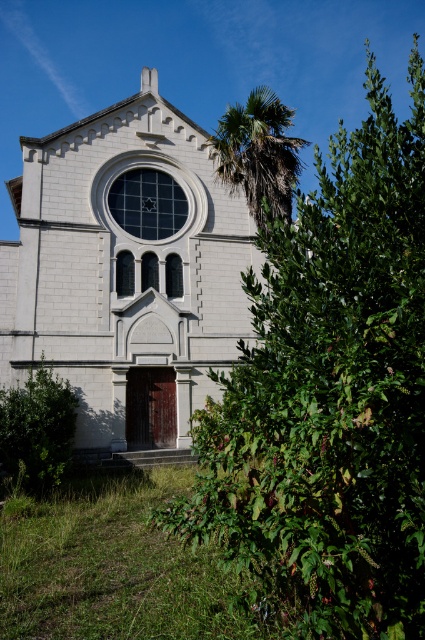
Is green leafy palm at upper center wider than green leafy bush at lower left?

Yes.

Who is positioned more to the left, green leafy palm at upper center or green leafy bush at lower left?

green leafy bush at lower left is more to the left.

What do you see at coordinates (257, 154) in the screenshot? This screenshot has height=640, width=425. I see `green leafy palm at upper center` at bounding box center [257, 154].

The height and width of the screenshot is (640, 425). Identify the location of green leafy palm at upper center. (257, 154).

Between point (107, 396) and point (286, 189), which one is positioned in front?

Point (286, 189)

Between white stone church at center and green leafy palm at upper center, which one has more height?

Standing taller between the two is green leafy palm at upper center.

Who is more forward, (39, 186) or (280, 116)?

Point (280, 116) is more forward.

At what (x,y) coordinates should I click in order to perform the action: click on white stone church at center. Please return your answer as a coordinate pair (x, y). The width and height of the screenshot is (425, 640). Looking at the image, I should click on (125, 269).

Is white stone church at center shorter than green leafy bush at lower left?

Incorrect, white stone church at center's height does not fall short of green leafy bush at lower left's.

Does white stone church at center lie behind green leafy bush at lower left?

Yes, it is.

Describe the element at coordinates (125, 269) in the screenshot. This screenshot has height=640, width=425. I see `white stone church at center` at that location.

Image resolution: width=425 pixels, height=640 pixels. What are the coordinates of `white stone church at center` in the screenshot? It's located at (125, 269).